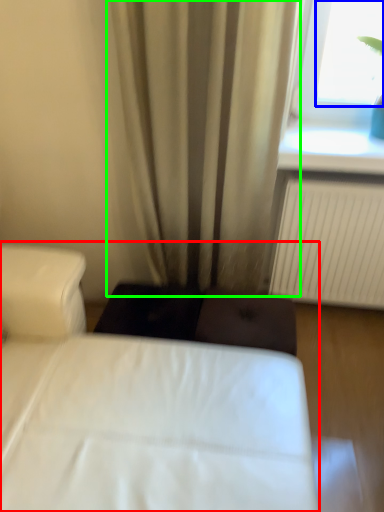
Question: Based on their relative distances, which object is farther from bed (highlighted by a red box)? Choose from window screen (highlighted by a blue box) and curtain (highlighted by a green box).

Choices:
 (A) window screen
 (B) curtain

Answer: (A)